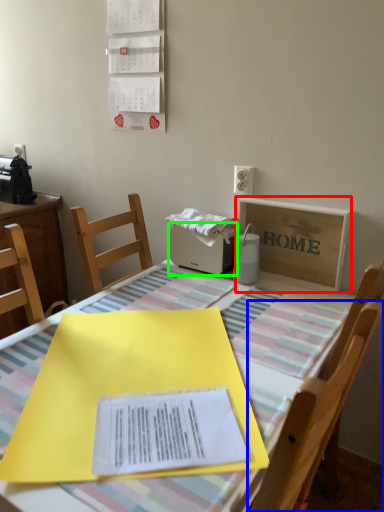
Question: Based on their relative distances, which object is nearer to cardboard box (highlighted by a red box)? Choose from chair (highlighted by a blue box) and appliance (highlighted by a green box).

Choices:
 (A) chair
 (B) appliance

Answer: (B)